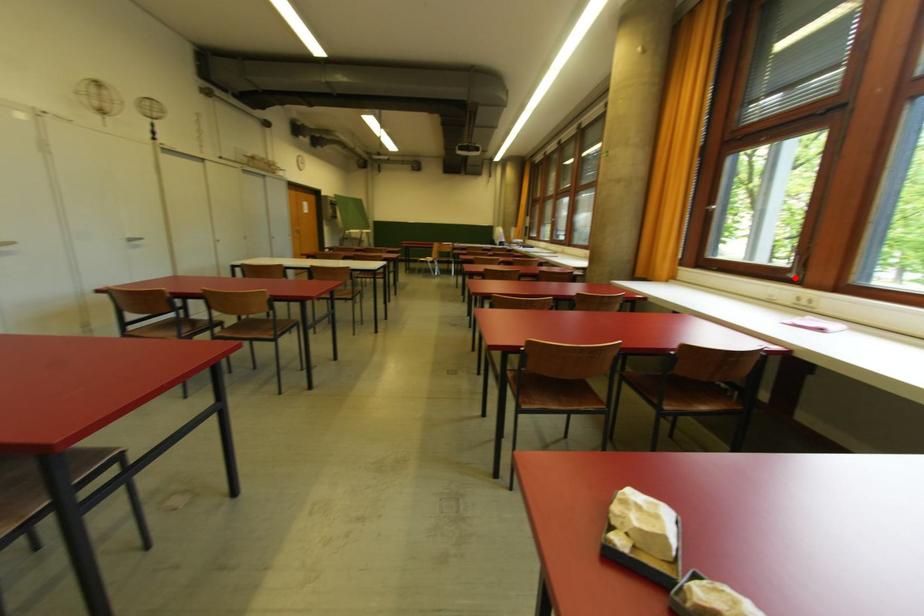
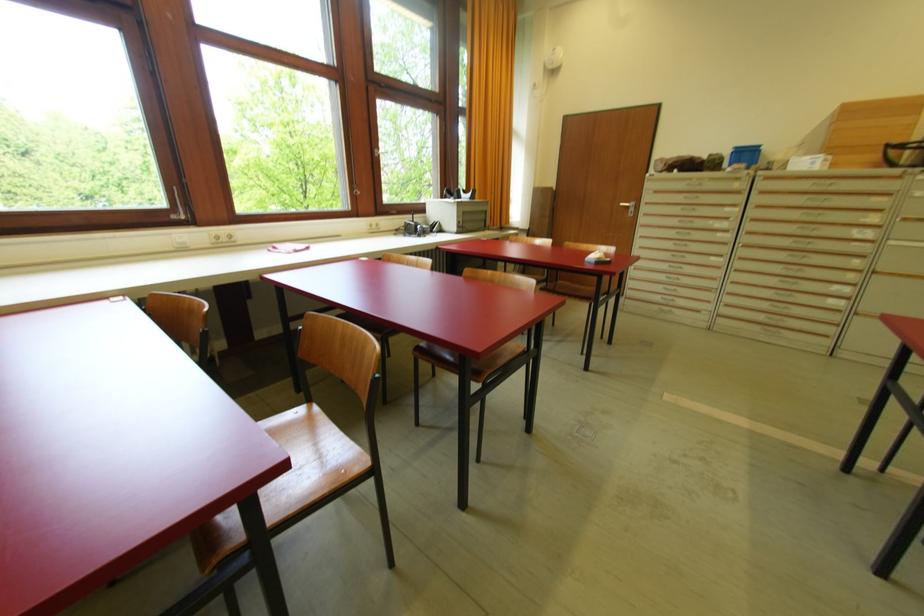
Where in the second image is the point corresponding to the highlighted location from the first image?

(186, 219)